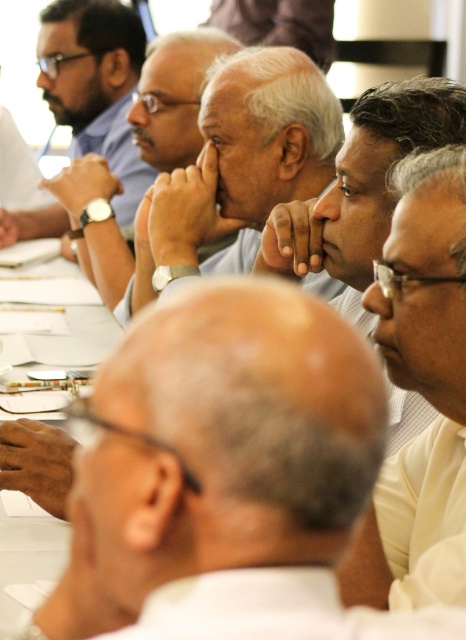
Question: Is the position of white matte shirt at right more distant than that of matte black shirt at upper left?

Choices:
 (A) yes
 (B) no

Answer: (B)

Question: Considering the real-world distances, which object is farthest from the matte black watch at upper left?

Choices:
 (A) white paper at center
 (B) gray matte shirt at center

Answer: (A)

Question: Which point is farther from the camera taking this photo?

Choices:
 (A) (90, 346)
 (B) (127, 138)

Answer: (B)

Question: Is white shirt at center above matte black watch at upper left?

Choices:
 (A) no
 (B) yes

Answer: (A)

Question: Which point is farther to the camera?

Choices:
 (A) (24, 376)
 (B) (246, 77)
 (C) (26, 220)
 (D) (82, 566)

Answer: (C)

Question: Does matte black watch at upper left come behind matte black shirt at upper left?

Choices:
 (A) yes
 (B) no

Answer: (A)